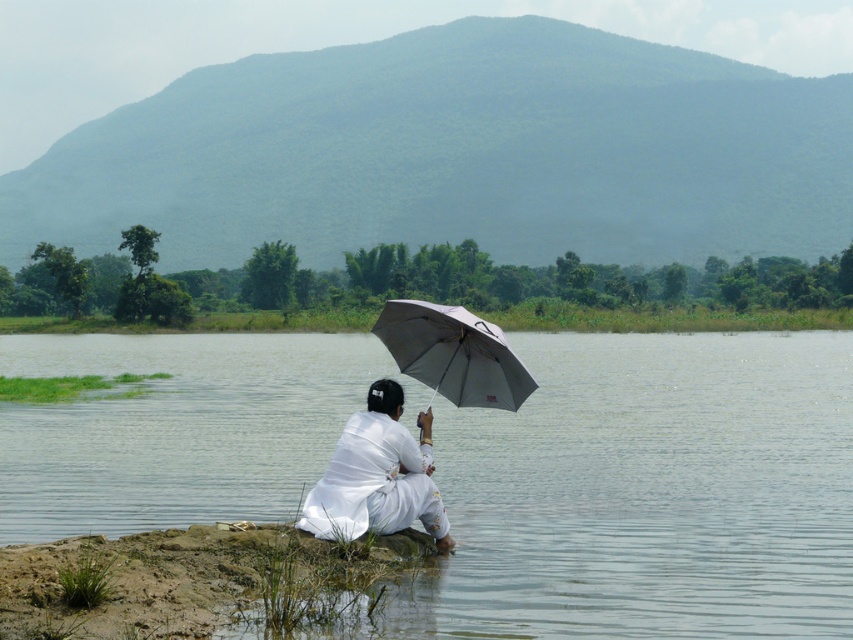
Which is behind, point (15, 358) or point (421, 328)?

Point (15, 358)

Does clear water at lower center have a lesser width compared to gray matte umbrella at center?

No, clear water at lower center is not thinner than gray matte umbrella at center.

Is point (462, 577) positioned in front of point (483, 394)?

That is True.

You are a GUI agent. You are given a task and a screenshot of the screen. Output one action in this format:
    pyautogui.click(x=<x>, y=<y>)
    Task: Click on the clear water at lower center
    This screenshot has width=853, height=640.
    Given the screenshot: What is the action you would take?
    pyautogui.click(x=650, y=492)

Between point (390, 381) and point (511, 369), which one is positioned in front?

Point (390, 381) is in front.

In the scene shown: Can you confirm if white matte fabric at center is smaller than gray matte umbrella at center?

Incorrect, white matte fabric at center is not smaller in size than gray matte umbrella at center.

The image size is (853, 640). Describe the element at coordinates (376, 476) in the screenshot. I see `white matte fabric at center` at that location.

Find the location of a particular element. The height and width of the screenshot is (640, 853). white matte fabric at center is located at coordinates (376, 476).

The width and height of the screenshot is (853, 640). Describe the element at coordinates (650, 492) in the screenshot. I see `clear water at lower center` at that location.

Measure the distance between clear water at lower center and white matte fabric at center.

clear water at lower center and white matte fabric at center are 45.41 feet apart.

Is point (751, 378) positioned after point (418, 486)?

That is True.

I want to click on clear water at lower center, so click(x=650, y=492).